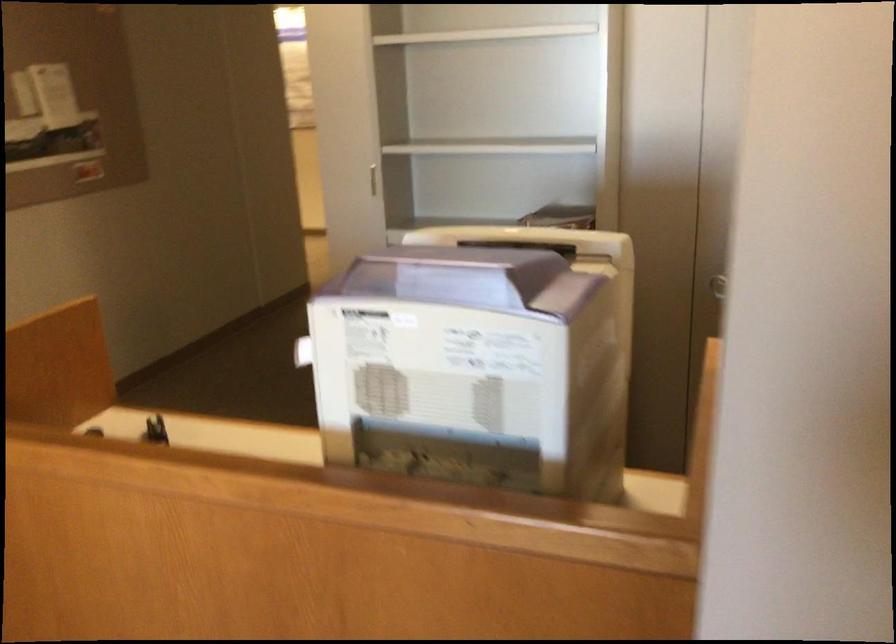
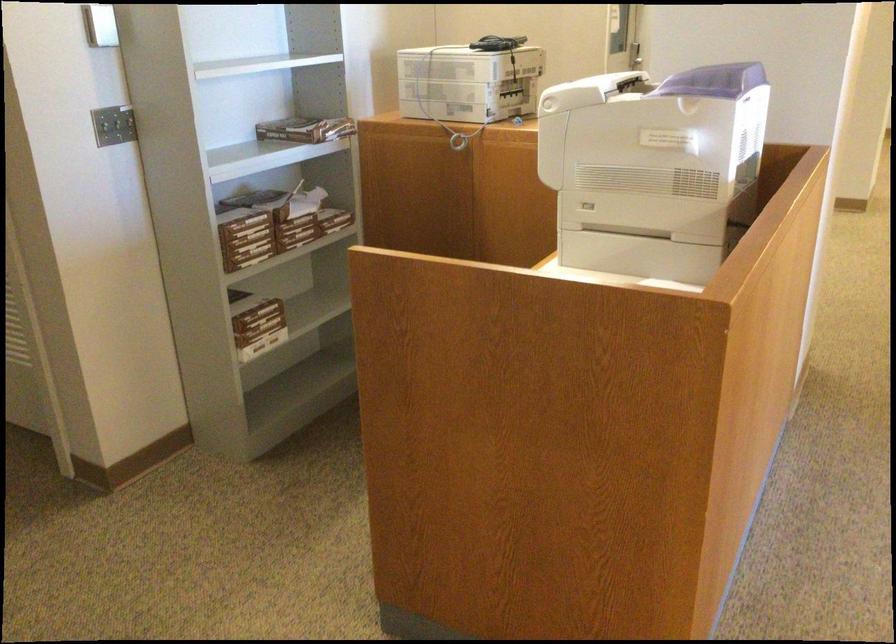
Where in the second image is the point corresponding to (347,316) from the first image?

(714, 80)